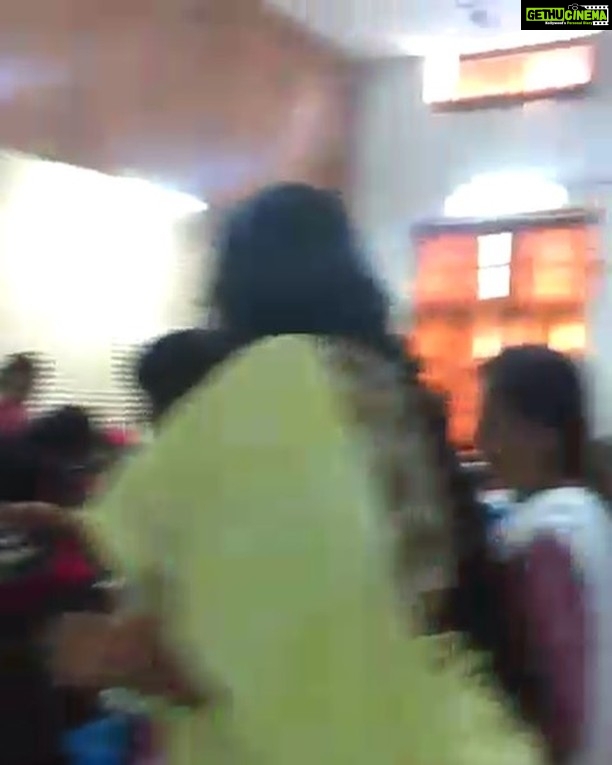
Locate an element on the screen. blinds is located at coordinates (108, 359).